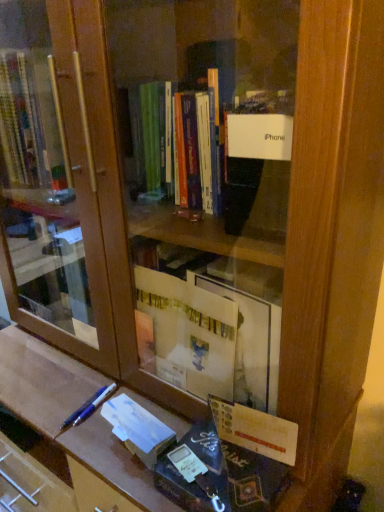
Question: Is white matte paperback book at lower center completely or partially inside blue metallic pen at lower left?

Choices:
 (A) yes
 (B) no

Answer: (B)

Question: From a real-world perspective, does blue metallic pen at lower left sit lower than white matte paperback book at lower center?

Choices:
 (A) yes
 (B) no

Answer: (A)

Question: Can you confirm if blue metallic pen at lower left is wider than white matte paperback book at lower center?

Choices:
 (A) no
 (B) yes

Answer: (B)

Question: Considering the relative sizes of blue metallic pen at lower left and white matte paperback book at lower center in the image provided, is blue metallic pen at lower left thinner than white matte paperback book at lower center?

Choices:
 (A) no
 (B) yes

Answer: (A)

Question: Is blue metallic pen at lower left behind white matte paperback book at lower center?

Choices:
 (A) yes
 (B) no

Answer: (A)

Question: From a real-world perspective, is blue metallic pen at lower left positioned over white matte paperback book at lower center based on gravity?

Choices:
 (A) no
 (B) yes

Answer: (A)

Question: Is white matte paperback book at lower center completely or partially outside of blue metallic pen at lower left?

Choices:
 (A) no
 (B) yes

Answer: (B)

Question: Is white matte paperback book at lower center looking in the opposite direction of blue metallic pen at lower left?

Choices:
 (A) no
 (B) yes

Answer: (A)

Question: Does white matte paperback book at lower center appear on the right side of blue metallic pen at lower left?

Choices:
 (A) yes
 (B) no

Answer: (A)

Question: Can you confirm if white matte paperback book at lower center is smaller than blue metallic pen at lower left?

Choices:
 (A) no
 (B) yes

Answer: (A)

Question: From a real-world perspective, is white matte paperback book at lower center below blue metallic pen at lower left?

Choices:
 (A) no
 (B) yes

Answer: (A)

Question: Does white matte paperback book at lower center have a greater width compared to blue metallic pen at lower left?

Choices:
 (A) no
 (B) yes

Answer: (A)

Question: From the image's perspective, is blue metallic pen at lower left above or below white matte paperback book at lower center?

Choices:
 (A) above
 (B) below

Answer: (A)